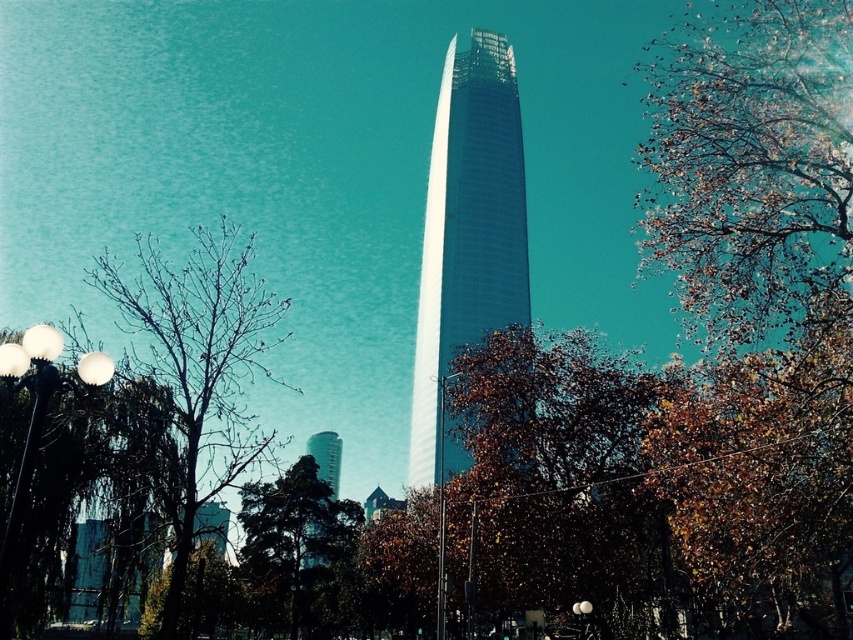
Question: Is white glossy lamp post at center smaller than smooth glass tower at center?

Choices:
 (A) yes
 (B) no

Answer: (A)

Question: Among these objects, which one is nearest to the camera?

Choices:
 (A) white glossy lamp post at left
 (B) brown leafy tree at lower left
 (C) green leafy tree at center
 (D) smooth glass tower at center

Answer: (A)

Question: Does bare branches at left lie in front of white glossy lamp post at center?

Choices:
 (A) no
 (B) yes

Answer: (B)

Question: Estimate the real-world distances between objects in this image. Which object is closer to the bare branches at left?

Choices:
 (A) smooth glass tower at center
 (B) white glossy lamp post at left
 (C) brown leafy tree at lower left

Answer: (C)

Question: Which object is positioned farthest from the brown leafy tree at lower left?

Choices:
 (A) green leafy tree at center
 (B) white glossy lamp post at left
 (C) glassy steel tower at center

Answer: (C)

Question: Does white glossy lamp post at left have a lesser width compared to smooth glass tower at center?

Choices:
 (A) no
 (B) yes

Answer: (A)